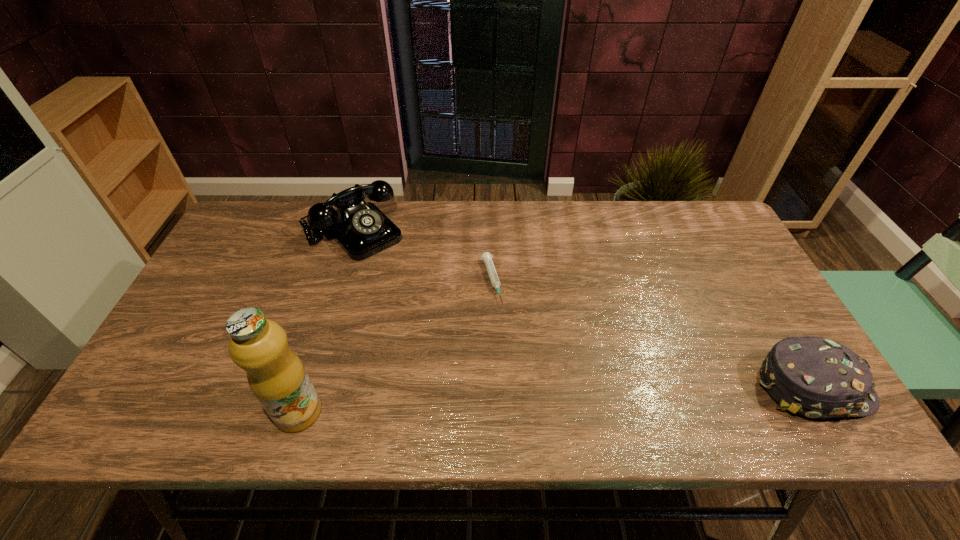
Identify the location of vacant area that lies between the tallest object and the second shortest object. (556, 399).

I want to click on free space between the telephone and the syringe, so [x=422, y=256].

Select which object appears as the third closest to the third object from left to right. Please provide its 2D coordinates. Your answer should be formatted as a tuple, i.e. [(x, y)], where the tuple contains the x and y coordinates of a point satisfying the conditions above.

[(815, 377)]

This screenshot has height=540, width=960. Find the location of `object that stands as the third closest to the fruit juice`. object that stands as the third closest to the fruit juice is located at coordinates (815, 377).

Identify the location of free spot that satisfies the following two spatial constraints: 1. on the front side of the rightmost object; 2. on the front-facing side of the second tallest object. (306, 386).

Where is `free spot that satisfies the following two spatial constraints: 1. on the front side of the third tallest object; 2. on the front-facing side of the shortest object`? free spot that satisfies the following two spatial constraints: 1. on the front side of the third tallest object; 2. on the front-facing side of the shortest object is located at coordinates (493, 386).